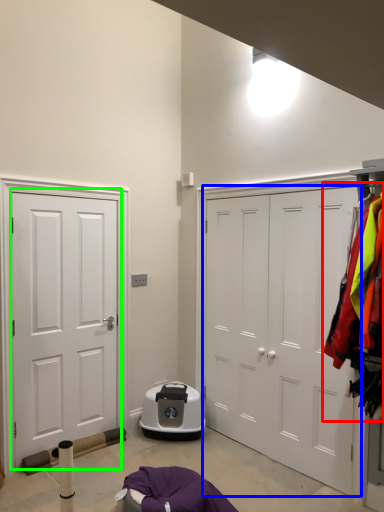
Question: Estimate the real-world distances between objects in this image. Which object is farther from laundry (highlighted by a red box), door (highlighted by a blue box) or door (highlighted by a green box)?

Choices:
 (A) door
 (B) door

Answer: (B)